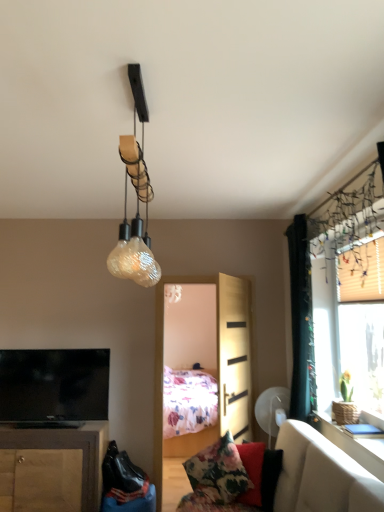
What do you see at coordinates (321, 475) in the screenshot?
I see `velvet beige couch at lower right` at bounding box center [321, 475].

Where is `white glossy table at upper right`? The width and height of the screenshot is (384, 512). white glossy table at upper right is located at coordinates (351, 444).

Describe the element at coordinates (234, 357) in the screenshot. This screenshot has height=512, width=384. I see `light wood screen door at center` at that location.

What are the coordinates of `white textured blinds at upper right` in the screenshot? It's located at (347, 318).

Describe the element at coordinates (54, 385) in the screenshot. The height and width of the screenshot is (512, 384). I see `flat screen tv at lower left` at that location.

Identify the location of black fabric curtain at right. [300, 317].

This screenshot has height=512, width=384. What are the coordinates of `wooden cabinet at lower left` in the screenshot? It's located at click(52, 468).

Is floral fabric pillow at lower center closer to camera compared to white textured blinds at upper right?

That is False.

In the scene shown: Is white textured blinds at upper right inside floral fabric pillow at lower center?

That's incorrect, white textured blinds at upper right is not inside floral fabric pillow at lower center.

From the image's perspective, relative to white textured blinds at upper right, is floral fabric pillow at lower center above or below?

Based on their image positions, floral fabric pillow at lower center is located beneath white textured blinds at upper right.

From the image's perspective, between black fabric curtain at right and wooden cabinet at lower left, which one is located above?

black fabric curtain at right appears higher in the image.

Can you see black fabric curtain at right touching wooden cabinet at lower left?

No, black fabric curtain at right is not making contact with wooden cabinet at lower left.

Is black fabric curtain at right turned away from wooden cabinet at lower left?

No, wooden cabinet at lower left is not at the back of black fabric curtain at right.

Which object is further away from the camera taking this photo, black fabric curtain at right or wooden cabinet at lower left?

wooden cabinet at lower left is behind.

Is light wood screen door at center placed right next to velvet beige couch at lower right?

light wood screen door at center and velvet beige couch at lower right are clearly separated.

Is light wood screen door at center not inside velvet beige couch at lower right?

Absolutely, light wood screen door at center is external to velvet beige couch at lower right.

Identify the location of screen door that appears above the velvet beige couch at lower right (from the image's perspective). The height and width of the screenshot is (512, 384). (234, 357).

From the picture: How different are the orientations of light wood screen door at center and velvet beige couch at lower right in degrees?

The angular difference between light wood screen door at center and velvet beige couch at lower right is 25.8 degrees.

From a real-world perspective, is white glossy table at upper right positioned above or below black fabric curtain at right?

In terms of real-world spatial position, white glossy table at upper right is below black fabric curtain at right.

From the picture: Is white glossy table at upper right wider than black fabric curtain at right?

Indeed, white glossy table at upper right has a greater width compared to black fabric curtain at right.

How many degrees apart are the facing directions of white glossy table at upper right and black fabric curtain at right?

0.875 degrees.

Is point (361, 462) closer or farther from the camera than point (301, 259)?

Point (361, 462) appears to be closer to the viewer than point (301, 259).

Looking at the image, does white textured blinds at upper right seem bigger or smaller compared to flat screen tv at lower left?

Clearly, white textured blinds at upper right is larger in size than flat screen tv at lower left.

From a real-world perspective, which object stands above the other?

white textured blinds at upper right.

Considering the relative positions of white textured blinds at upper right and flat screen tv at lower left in the image provided, is white textured blinds at upper right in front of flat screen tv at lower left?

Yes, white textured blinds at upper right is in front of flat screen tv at lower left.

Between point (310, 393) and point (81, 362), which one is positioned behind?

The point (81, 362) is more distant.

This screenshot has width=384, height=512. In the image, there is a wooden cabinet at lower left. Find the location of `television above it (from the image's perspective)`. television above it (from the image's perspective) is located at coordinates (54, 385).

Can you tell me how much wooden cabinet at lower left and flat screen tv at lower left differ in facing direction?

The facing directions of wooden cabinet at lower left and flat screen tv at lower left are 0.62 degrees apart.

Is wooden cabinet at lower left positioned with its back to flat screen tv at lower left?

wooden cabinet at lower left is not turned away from flat screen tv at lower left.

Does wooden cabinet at lower left have a greater width compared to flat screen tv at lower left?

Correct, the width of wooden cabinet at lower left exceeds that of flat screen tv at lower left.

Are wooden cabinet at lower left and light wood screen door at center making contact?

No, wooden cabinet at lower left is not with light wood screen door at center.

Which object is positioned more to the right, wooden cabinet at lower left or light wood screen door at center?

light wood screen door at center.

Who is bigger, wooden cabinet at lower left or light wood screen door at center?

wooden cabinet at lower left is bigger.

Is wooden cabinet at lower left in front of or behind light wood screen door at center in the image?

In the image, wooden cabinet at lower left appears behind light wood screen door at center.

At what (x,y) coordinates should I click in order to perform the action: click on pillow on the left of white textured blinds at upper right. Please return your answer as a coordinate pair (x, y). The height and width of the screenshot is (512, 384). Looking at the image, I should click on (218, 472).

Locate an element on the screen. The width and height of the screenshot is (384, 512). curtain that is above the wooden cabinet at lower left (from a real-world perspective) is located at coordinates (300, 317).

Based on the photo, when comparing their distances from velvet beige couch at lower right, does white textured blinds at upper right or black fabric curtain at right seem further?

Based on the image, white textured blinds at upper right appears to be further to velvet beige couch at lower right.

Looking at this image, based on their spatial positions, is floral fabric pillow at lower center or white glossy table at upper right further from velvet beige couch at lower right?

white glossy table at upper right is positioned further to the anchor velvet beige couch at lower right.

Which object lies nearer to the anchor point velvet beige couch at lower right, flat screen tv at lower left or wooden cabinet at lower left?

Among the two, wooden cabinet at lower left is located nearer to velvet beige couch at lower right.

Looking at the image, which one is located further to velvet beige couch at lower right, floral fabric pillow at lower center or black fabric curtain at right?

black fabric curtain at right.

Based on their spatial positions, is floral fabric pillow at lower center or white glossy table at upper right further from black fabric curtain at right?

Based on the image, floral fabric pillow at lower center appears to be further to black fabric curtain at right.

Looking at the image, which one is located closer to wooden cabinet at lower left, light wood screen door at center or velvet beige couch at lower right?

Among the two, velvet beige couch at lower right is located nearer to wooden cabinet at lower left.

Based on their spatial positions, is light wood screen door at center or flat screen tv at lower left further from velvet beige couch at lower right?

The object further to velvet beige couch at lower right is flat screen tv at lower left.

Considering their positions, is black fabric curtain at right positioned closer to floral fabric pillow at lower center than flat screen tv at lower left?

black fabric curtain at right is positioned closer to the anchor floral fabric pillow at lower center.

This screenshot has width=384, height=512. I want to click on pillow situated between flat screen tv at lower left and black fabric curtain at right from left to right, so click(218, 472).

The height and width of the screenshot is (512, 384). I want to click on television between wooden cabinet at lower left and white textured blinds at upper right, so click(x=54, y=385).

Where is `pillow between flat screen tv at lower left and light wood screen door at center from left to right`? The image size is (384, 512). pillow between flat screen tv at lower left and light wood screen door at center from left to right is located at coordinates (218, 472).

The height and width of the screenshot is (512, 384). What are the coordinates of `curtain between wooden cabinet at lower left and white textured blinds at upper right from left to right` in the screenshot? It's located at pyautogui.click(x=300, y=317).